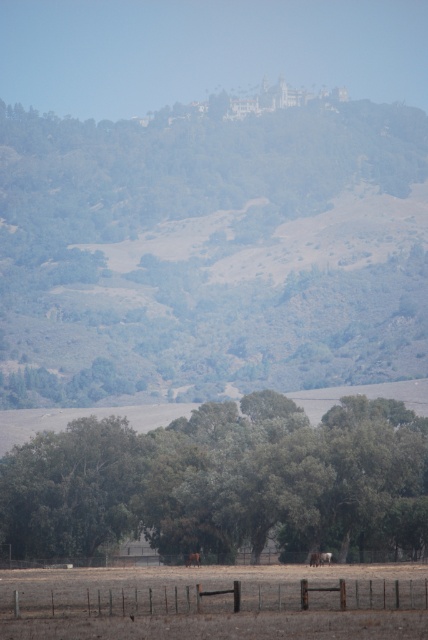
Can you confirm if green leafy tree at center is wider than green leafy tree at lower center?

Yes, green leafy tree at center is wider than green leafy tree at lower center.

Between green leafy tree at center and green leafy tree at lower center, which one has less height?

green leafy tree at lower center

Locate an element on the screen. This screenshot has width=428, height=640. green leafy tree at center is located at coordinates (211, 250).

Locate an element on the screen. green leafy tree at center is located at coordinates (211, 250).

Does point (220, 346) come closer to viewer compared to point (29, 611)?

That is False.

The width and height of the screenshot is (428, 640). What do you see at coordinates (211, 250) in the screenshot? I see `green leafy tree at center` at bounding box center [211, 250].

Locate an element on the screen. This screenshot has width=428, height=640. green leafy tree at center is located at coordinates (211, 250).

Is green leafy tree at lower center to the right of brown furry horse at lower center from the viewer's perspective?

Correct, you'll find green leafy tree at lower center to the right of brown furry horse at lower center.

Is green leafy tree at lower center taller than brown furry horse at lower center?

Yes.

Does point (140, 493) lie in front of point (193, 561)?

No.

The width and height of the screenshot is (428, 640). I want to click on green leafy tree at lower center, so click(220, 480).